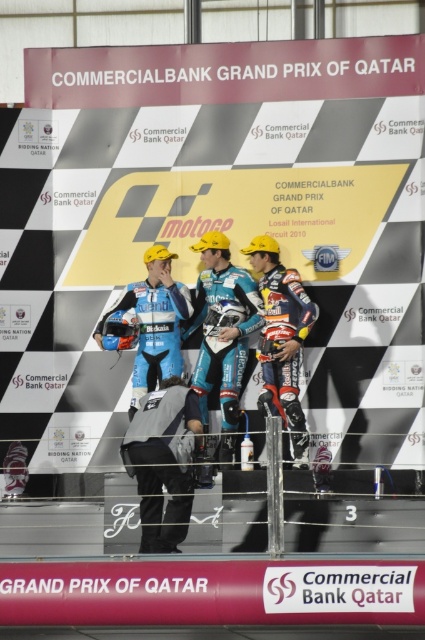
You are a photographer at the Commercial Bank Grand Prix of Qatar. You need to capture a photo of the gray fabric jacket at center and the blue matte suit at center for a sponsor. The sponsor wants to know which item is shorter in height. What do you tell them?

The gray fabric jacket at center has a lesser height compared to the blue matte suit at center, so the gray fabric jacket at center is shorter in height.

You are a photographer standing at the starting line of the Commercial Bank Grand Prix of Qatar. You want to capture a photo of the two points marked in the image. Which point is closer to you, point (158, 499) or point (170, 323)?

Point (158, 499) is closer to the camera than point (170, 323), so it is closer to you.

Looking at this image, you are a photographer at the Commercial Bank Grand Prix of Qatar. You need to capture a photo of the gray fabric jacket at center. According to the scene description, where exactly is the gray fabric jacket positioned in the image?

The gray fabric jacket at center is located at point (x=163, y=461).